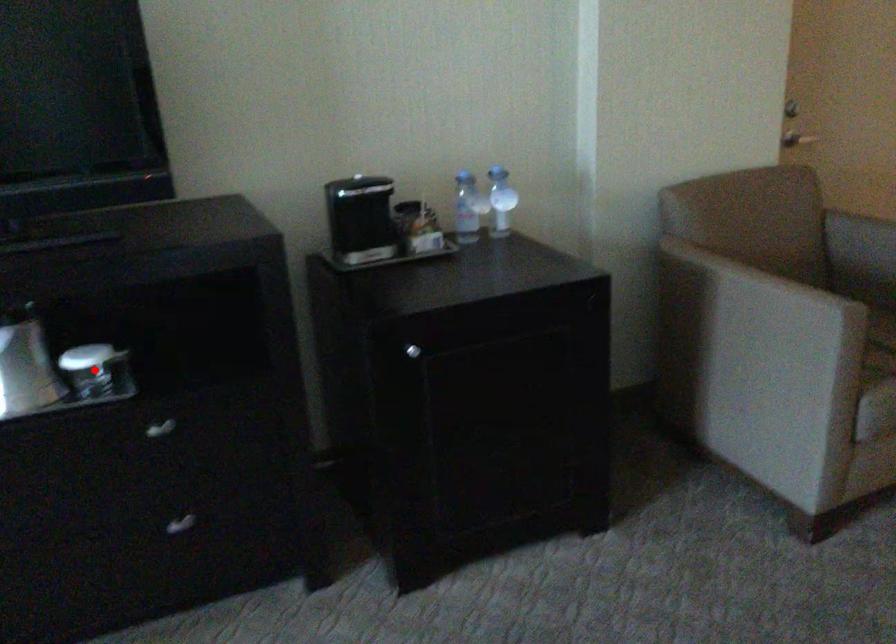
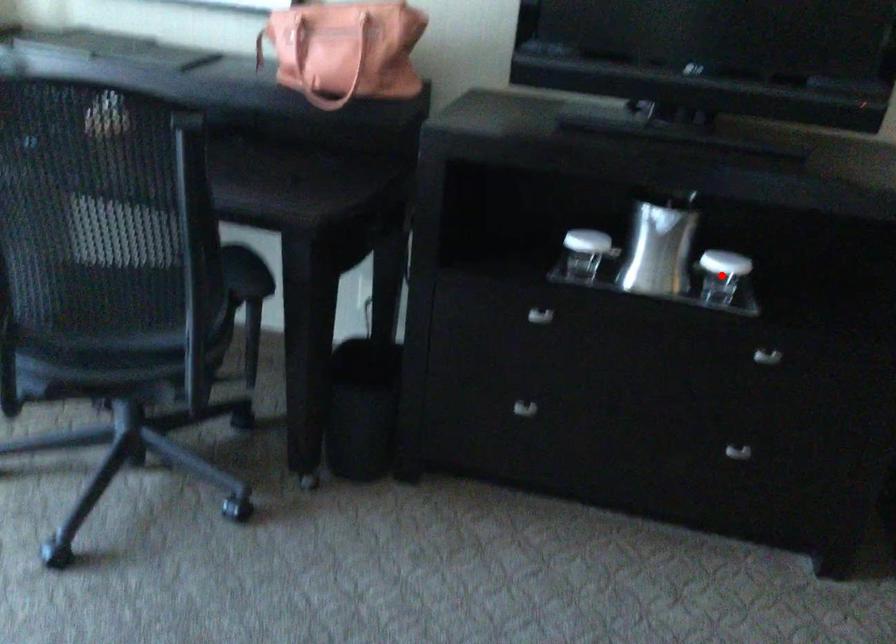
I am providing you with two images of the same scene from different viewpoints. A red point is marked on the first image and another point is marked on the second image. Are the points marked in image1 and image2 representing the same 3D position?

Yes